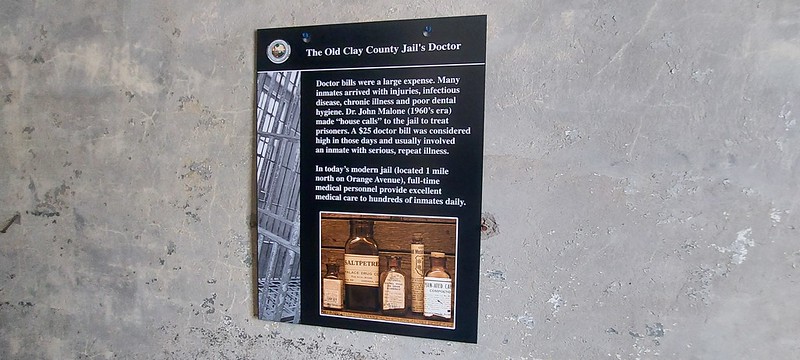
You are a GUI agent. You are given a task and a screenshot of the screen. Output one action in this format:
    pyautogui.click(x=<x>, y=<y>)
    Task: Click on the wooden boards
    The width and height of the screenshot is (800, 360).
    Given the screenshot: What is the action you would take?
    pos(328,214), pos(332,229), pos(324,258)